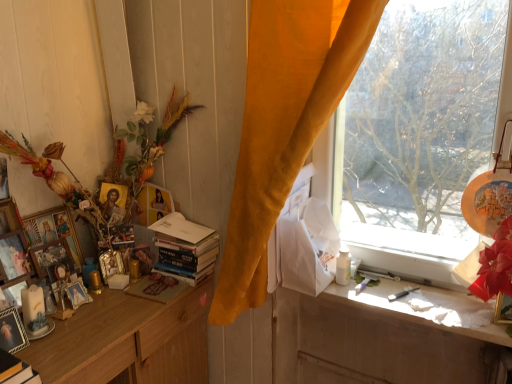
Question: In the image, is gold metallic picture frame at upper right, the 9th picture frame viewed from the left, positioned in front of or behind matte silver picture frame at lower left, marked as the 5th picture frame in a right-to-left arrangement?

Choices:
 (A) front
 (B) behind

Answer: (A)

Question: Is gold metallic picture frame at upper right, placed as the first picture frame when sorted from right to left, spatially inside matte silver picture frame at lower left, marked as the 5th picture frame in a right-to-left arrangement, or outside of it?

Choices:
 (A) inside
 (B) outside

Answer: (B)

Question: Considering the real-world distances, which object is farthest from the white glossy bottle at window?

Choices:
 (A) wooden textured vase at left
 (B) matte silver picture frame at lower left, marked as the 5th picture frame in a right-to-left arrangement
 (C) wooden picture frame at left, which is the 6th picture frame in right-to-left order
 (D) silver metallic picture frame at left, arranged as the eighth picture frame when viewed from the left
 (E) white paper bag at right

Answer: (C)

Question: Considering the real-world distances, which object is closest to the matte silver picture frame at lower left, marked as the 5th picture frame in a right-to-left arrangement?

Choices:
 (A) gold leaf picture frame at upper left, which ranks as the 7th picture frame in left-to-right order
 (B) wooden picture frame at left, the ninth picture frame when ordered from right to left
 (C) wooden picture frame at left, arranged as the fourth picture frame when viewed from the right
 (D) gold metallic picture frame at upper right, the 9th picture frame viewed from the left
 (E) matte gold picture frame at left, the 3th picture frame positioned from the left

Answer: (E)